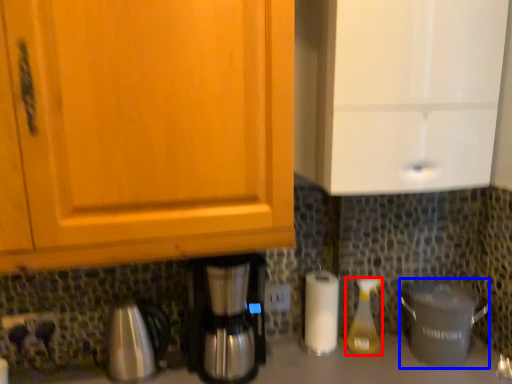
Question: Among these objects, which one is farthest to the camera, bottle (highlighted by a red box) or crock pot (highlighted by a blue box)?

Choices:
 (A) bottle
 (B) crock pot

Answer: (A)